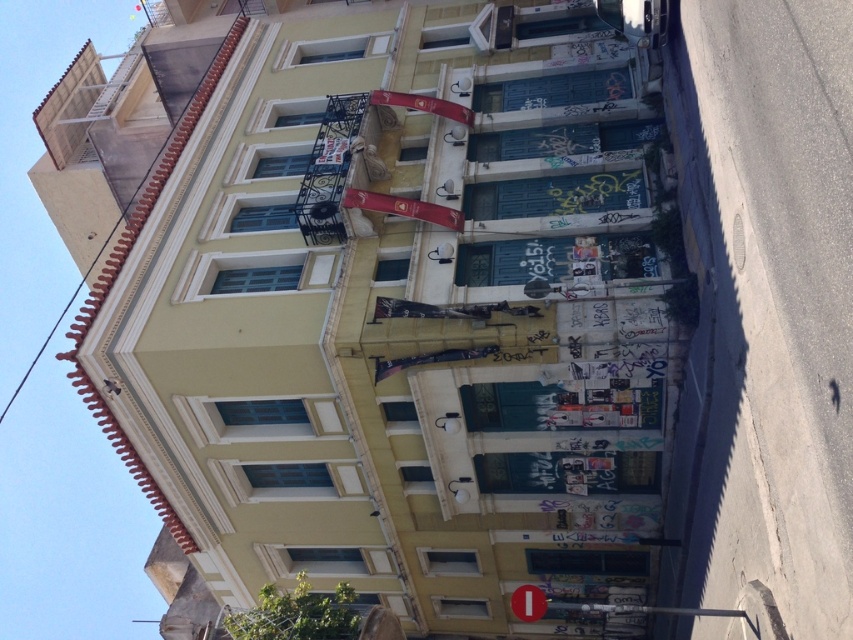
Which of these two, asphalt at lower right or red matte sign at lower center, stands shorter?

red matte sign at lower center

Between point (759, 513) and point (537, 596), which one is positioned in front?

Point (759, 513) is in front.

Locate an element on the screen. The height and width of the screenshot is (640, 853). asphalt at lower right is located at coordinates click(x=764, y=310).

Can you confirm if asphalt at lower right is smaller than metallic banner at center?

No, asphalt at lower right is not smaller than metallic banner at center.

Which is in front, point (763, 532) or point (392, 200)?

Point (763, 532)

At what (x,y) coordinates should I click in order to perform the action: click on asphalt at lower right. Please return your answer as a coordinate pair (x, y). The width and height of the screenshot is (853, 640). Looking at the image, I should click on (764, 310).

Where is `asphalt at lower right`? asphalt at lower right is located at coordinates (764, 310).

Can you confirm if asphalt at lower right is taller than red fabric flag at upper center?

Correct, asphalt at lower right is much taller as red fabric flag at upper center.

Does point (747, 556) come behind point (438, 100)?

No.

Where is `asphalt at lower right`? This screenshot has width=853, height=640. asphalt at lower right is located at coordinates (764, 310).